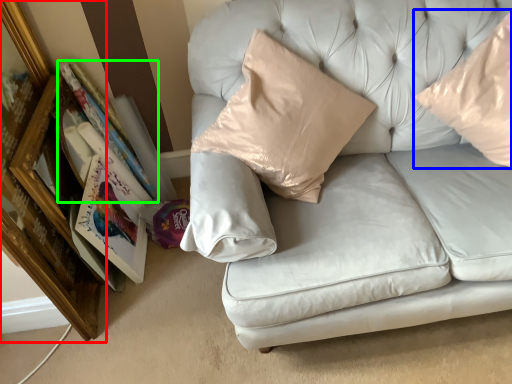
Question: Considering the real-world distances, which object is closest to picture frame (highlighted by a red box)? pillow (highlighted by a blue box) or book (highlighted by a green box).

Choices:
 (A) pillow
 (B) book

Answer: (B)